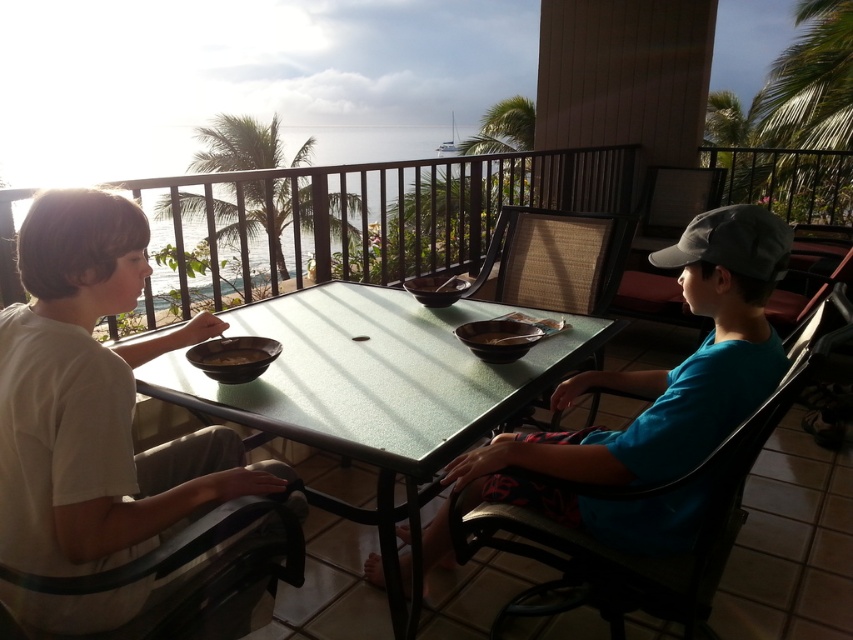
You are a parent preparing to seat your child for dinner. You have two chairs available, the black plastic chair at right and the woven wicker chair at center. Considering the height of the table, which chair would be more appropriate for a child who needs to comfortably reach the table surface?

The black plastic chair at right has a lesser height compared to the woven wicker chair at center, making it more appropriate for a child who needs to comfortably reach the table surface.

You are a delivery robot that needs to place a small package on the table between the black plastic chair at right and the brown matte bowl at center. Can you fit the package there without moving any objects?

The black plastic chair at right is larger in size than the brown matte bowl at center, so there might be enough space between them to place the small package without moving any objects.